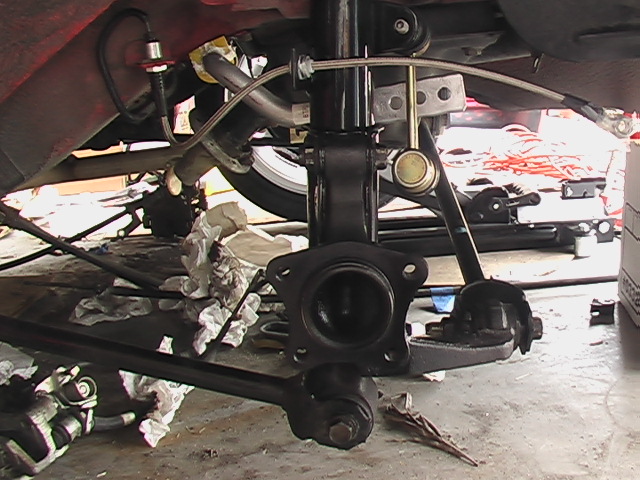
Identify the location of frame. This screenshot has width=640, height=480. (58, 118).